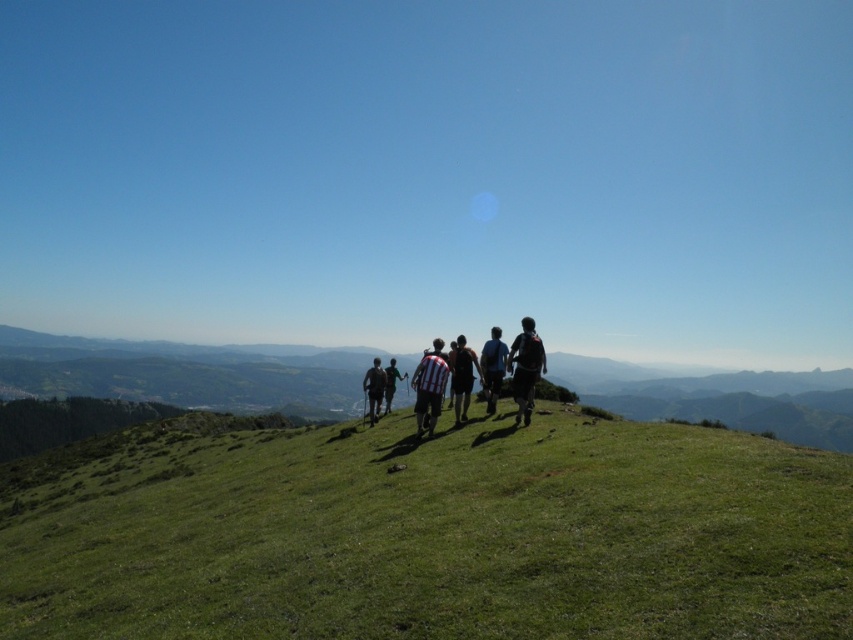
Who is positioned more to the right, striped jersey at center or black fabric backpack at center?

From the viewer's perspective, black fabric backpack at center appears more on the right side.

Does point (437, 337) lie behind point (491, 392)?

No, (437, 337) is in front of (491, 392).

The width and height of the screenshot is (853, 640). Find the location of `striped jersey at center`. striped jersey at center is located at coordinates (428, 387).

Where is `striped jersey at center`? This screenshot has height=640, width=853. striped jersey at center is located at coordinates (428, 387).

Between dark gray backpack at center and striped fabric shirt at center, which one is positioned higher?

Positioned higher is striped fabric shirt at center.

Consider the image. Is dark gray backpack at center taller than striped fabric shirt at center?

Indeed, dark gray backpack at center has a greater height compared to striped fabric shirt at center.

Locate an element on the screen. dark gray backpack at center is located at coordinates (374, 388).

This screenshot has width=853, height=640. What do you see at coordinates (428, 387) in the screenshot?
I see `striped jersey at center` at bounding box center [428, 387].

Consider the image. Who is shorter, striped jersey at center or striped fabric backpack at center?

Standing shorter between the two is striped jersey at center.

Which is in front, point (427, 368) or point (463, 356)?

Positioned in front is point (427, 368).

This screenshot has height=640, width=853. Find the location of `striped jersey at center`. striped jersey at center is located at coordinates (428, 387).